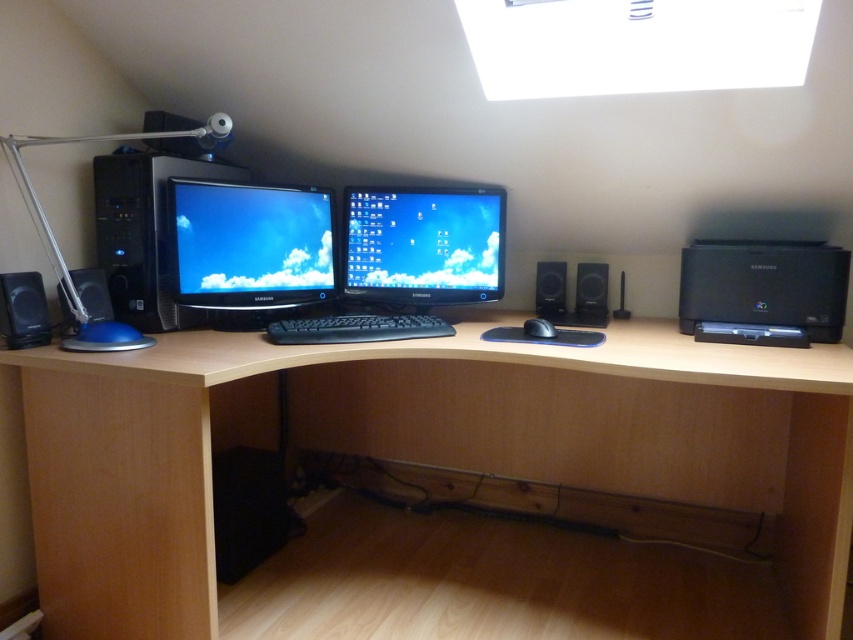
In the scene shown: You are setting up a new desk arrangement and want to place a decorative plant between the black plastic speaker at left and the black matte speaker at center. Based on their positions, where should you place the plant?

The black plastic speaker at left is located below the black matte speaker at center, so placing the plant between them would require positioning it above the black plastic speaker at left and below the black matte speaker at center.

You are setting up a home office and want to place a 4.5 inch wide plant between the black plastic speaker at right and the black matte speaker at center. Based on the space between them, will the plant fit?

The black plastic speaker at right and black matte speaker at center are 3.05 inches apart. Since the plant is 4.5 inches wide, it won